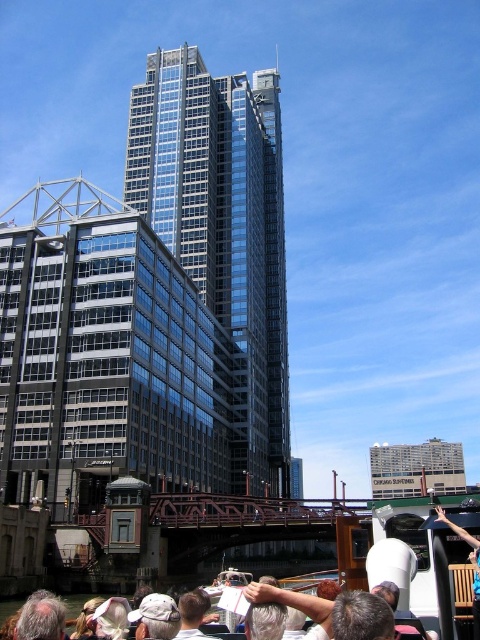
Question: Which point is farther from the camera taking this photo?

Choices:
 (A) (149, 612)
 (B) (49, 611)
 (C) (240, 150)

Answer: (C)

Question: Which is nearer to the glassy steel skyscraper at center?

Choices:
 (A) white fabric cap at lower center
 (B) gray hair at lower left

Answer: (B)

Question: Based on their relative distances, which object is nearer to the gray hair at lower left?

Choices:
 (A) glassy steel skyscraper at center
 (B) white fabric cap at lower center

Answer: (B)

Question: Does gray hair at lower left lie in front of white fabric cap at lower center?

Choices:
 (A) no
 (B) yes

Answer: (B)

Question: Does gray hair at lower left appear over white fabric cap at lower center?

Choices:
 (A) yes
 (B) no

Answer: (B)

Question: Can you confirm if gray hair at lower left is positioned below white fabric cap at lower center?

Choices:
 (A) no
 (B) yes

Answer: (B)